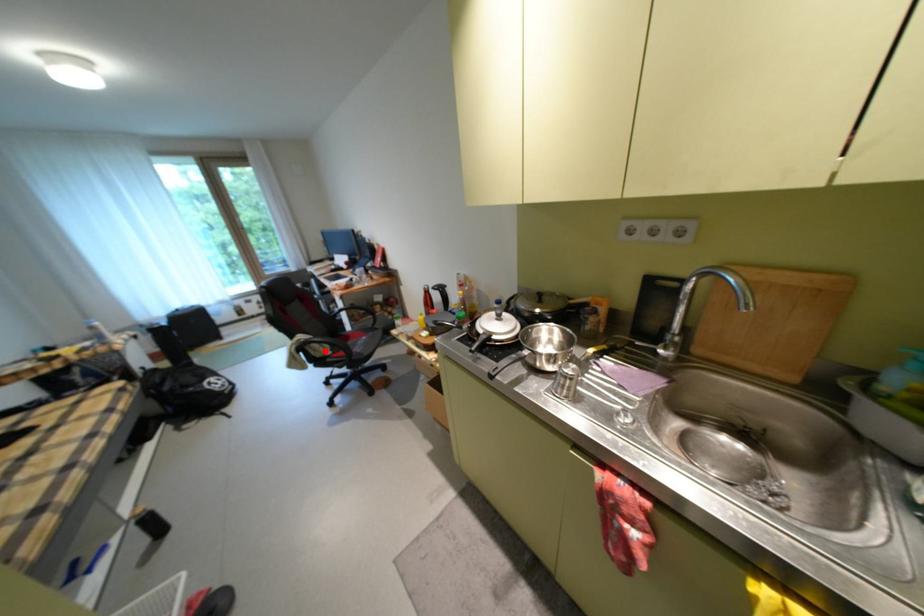
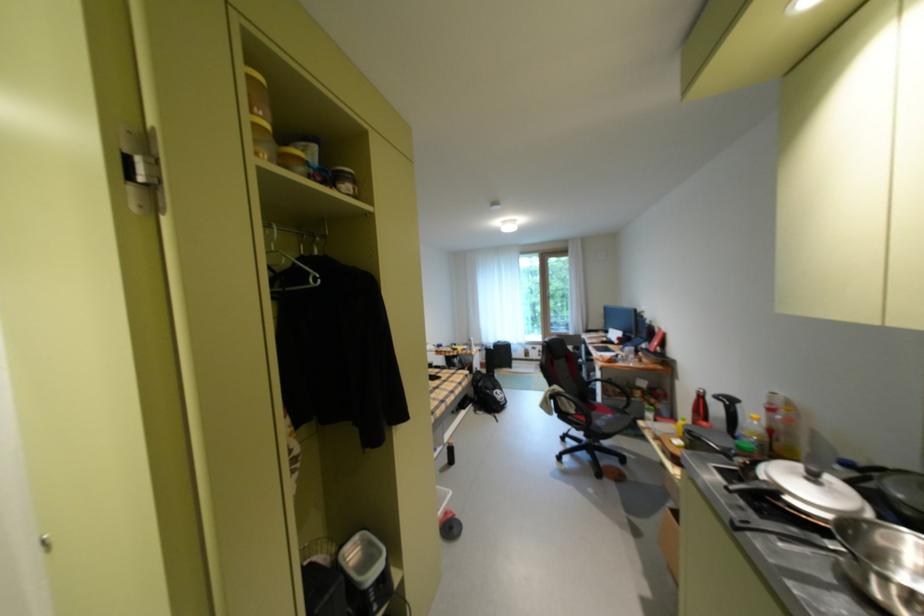
The point at the highlighted location is marked in the first image. Where is the corresponding point in the second image?

(573, 405)